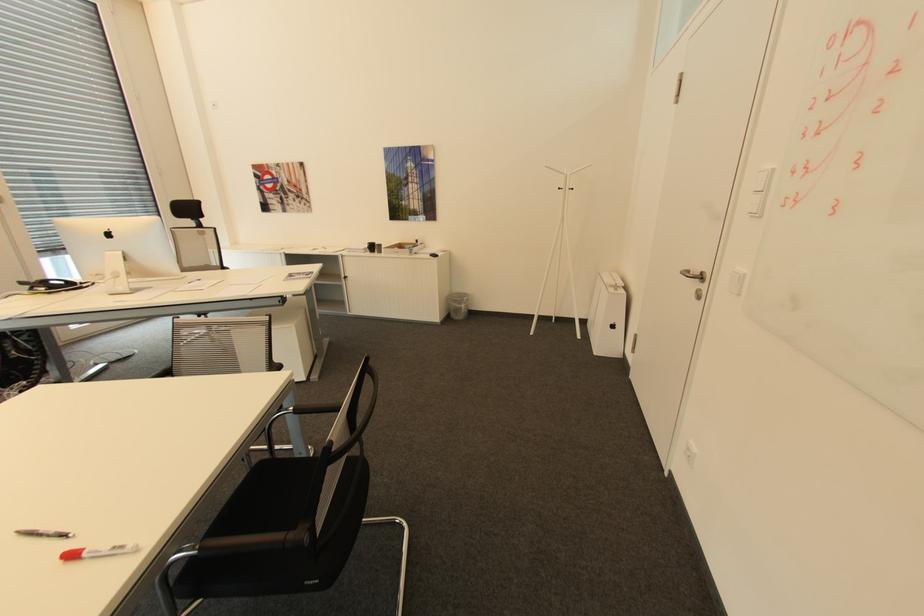
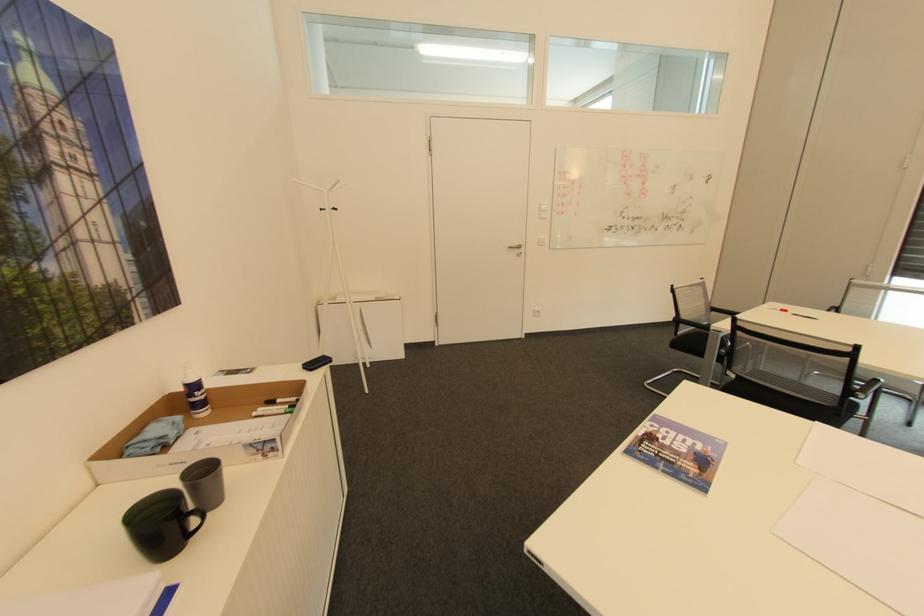
Where in the second image is the point corresponding to the point at 706,277 from the first image?

(524, 246)